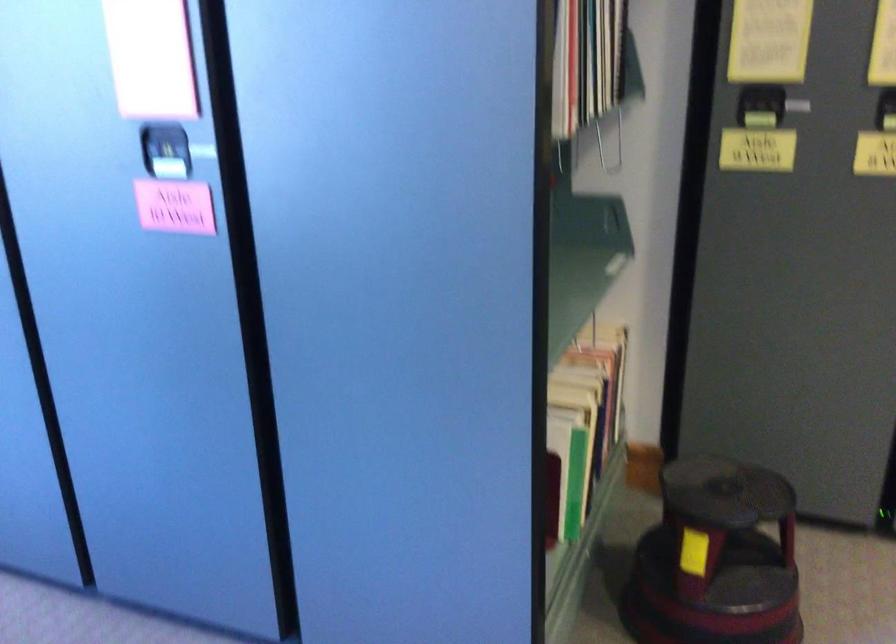
What do you see at coordinates (165, 151) in the screenshot? I see `the black locker handle` at bounding box center [165, 151].